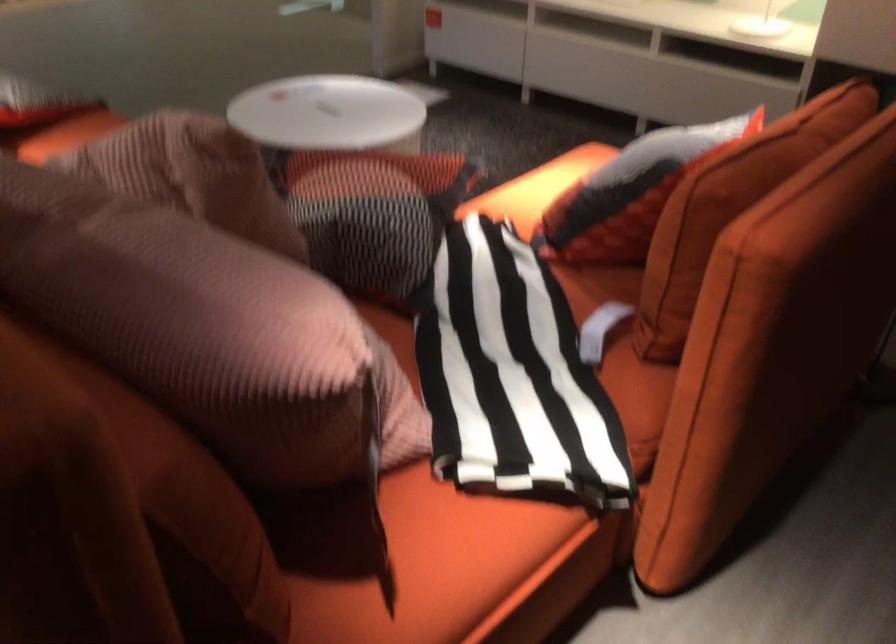
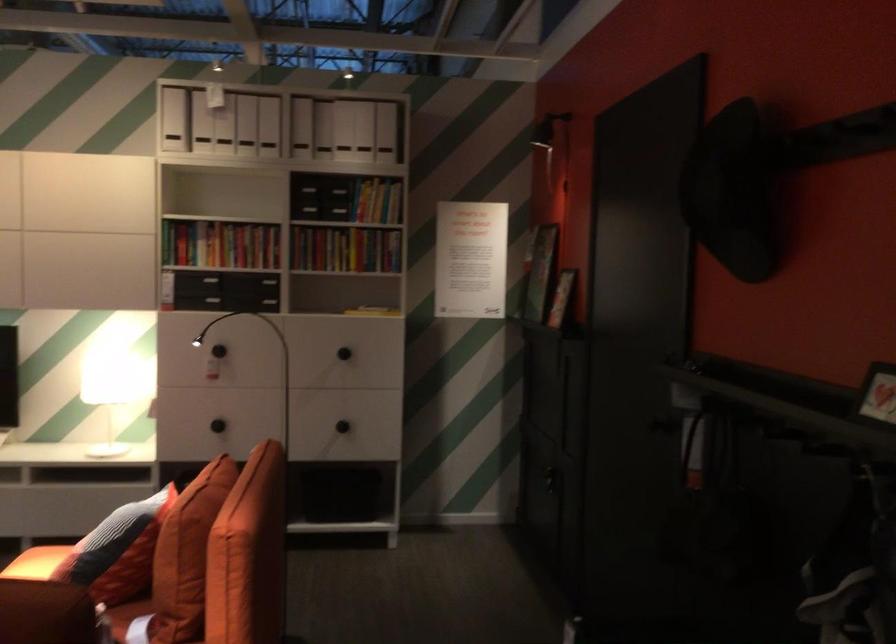
Find the pixel in the second image that matches [624,192] in the first image.

(117, 551)